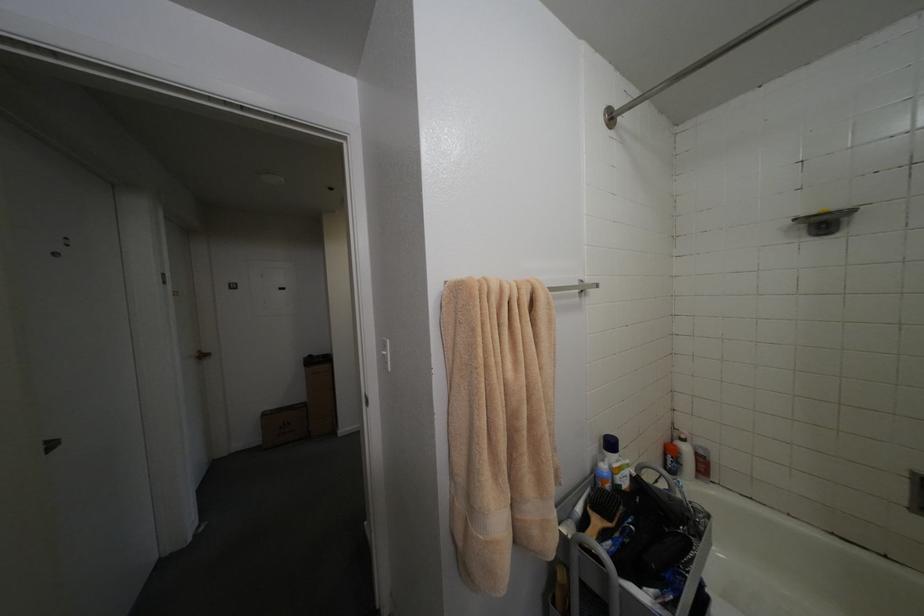
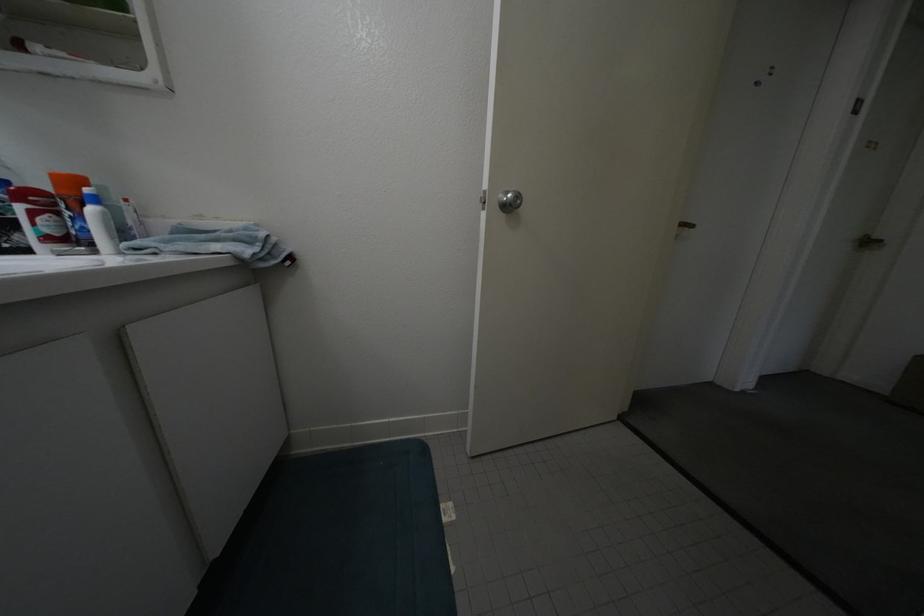
How did the camera likely rotate?

The camera's rotation is toward left-down.